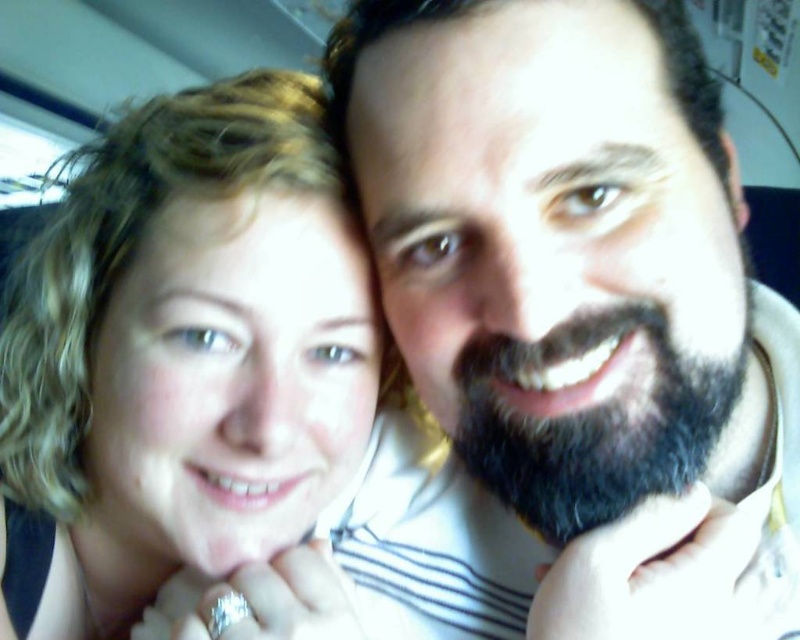
You are sitting in the backseat of a car and want to reach a point that is closer to you. You have two points to choose from in the image, point (165, 269) and point (662, 376). Which point is closer to you?

Point (165, 269) is further to the viewer than point (662, 376), so the closer point to you is point (662, 376).

You are a photographer trying to capture a closeup of the blonde hair at left. The camera you are using has a minimum focusing distance of 15 inches. Can you take the photo without moving the camera or the subject?

The blonde hair at left and camera are 14.99 inches apart, which is less than the camera minimum focusing distance of 15 inches. Therefore, you cannot take the photo without moving the camera or the subject.

You are a photographer trying to capture a closeup shot of both the blonde hair at left and the dark brown fuzzy beard at center. Given that your camera has a depth of field that can focus on objects within a 7 inch range, will both subjects be in focus?

The distance between the blonde hair at left and dark brown fuzzy beard at center is 7.58 inches, which exceeds the camera sensor depth of field range of 7 inches. Therefore, both subjects cannot be in focus simultaneously.